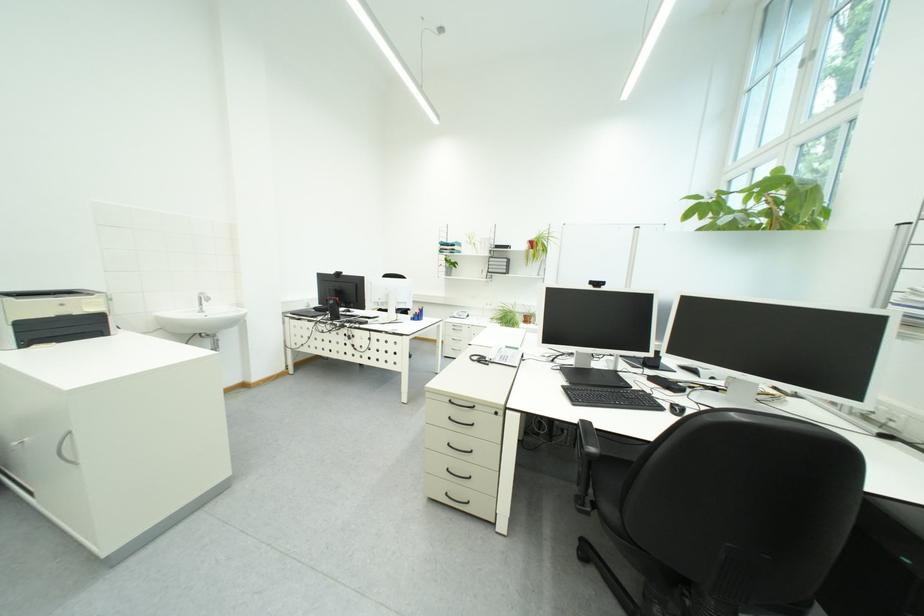
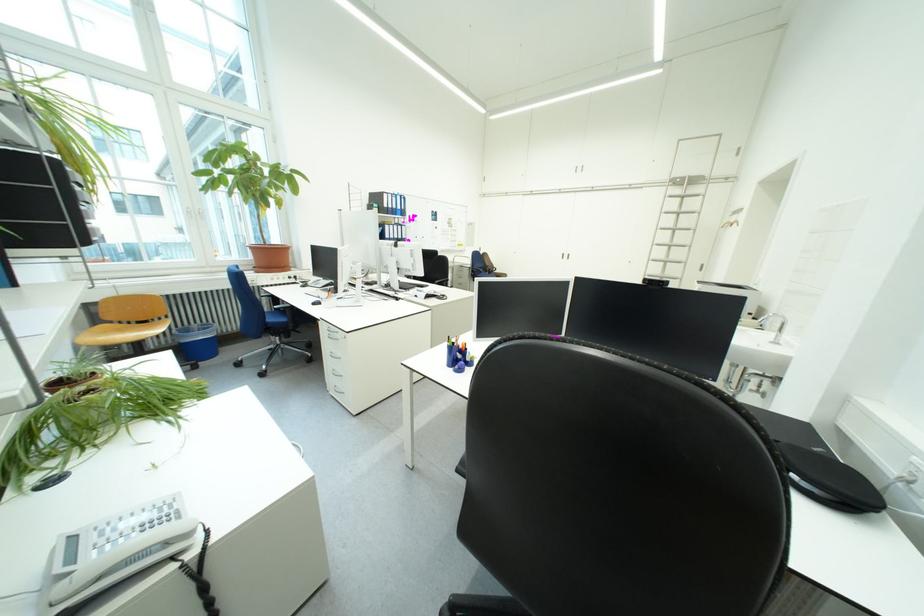
Question: I am providing you with two images of the same scene from different viewpoints. After the viewpoint changes to image2, which objects are now occluded?

Choices:
 (A) black chair sitting surface
 (B) pillow handle
 (C) recessed drawer handle
 (D) ladder rung

Answer: (A)